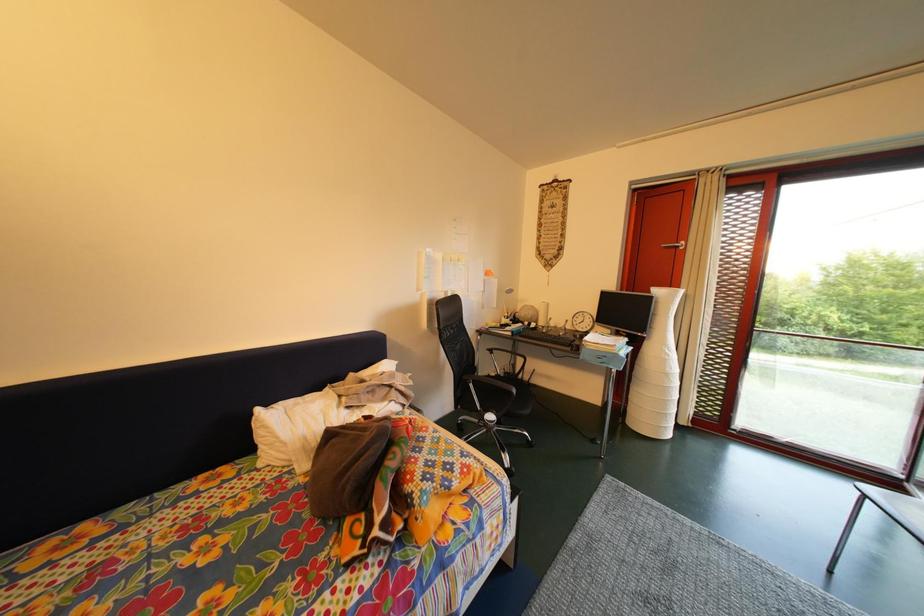
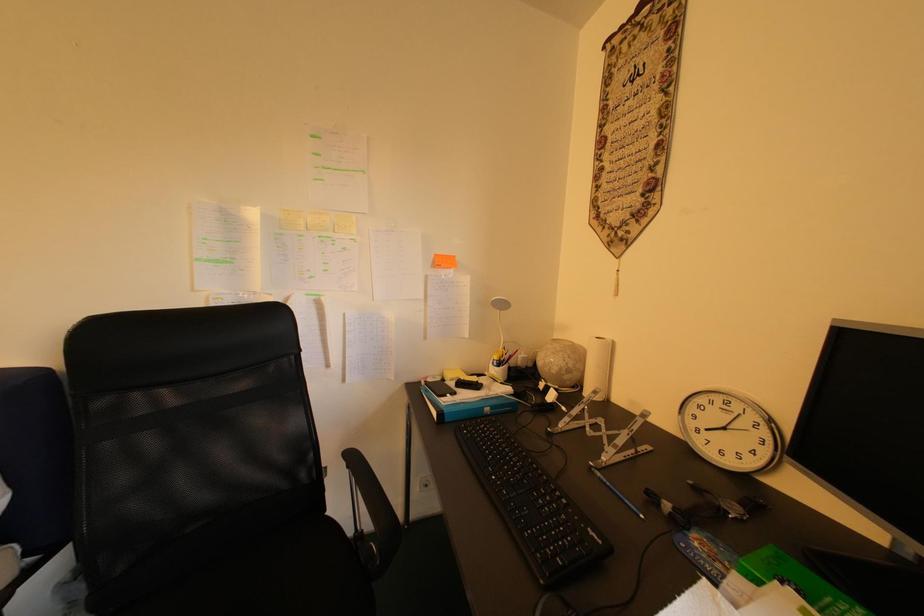
Based on the photo, which direction would the cameraman need to move to produce the second image?

The movement direction of the cameraman is right, forward.